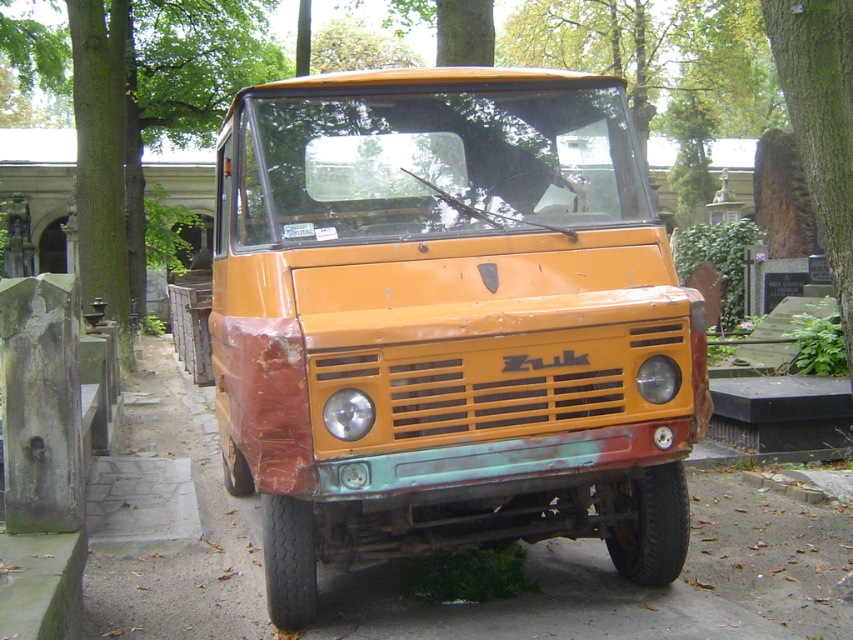
You are a delivery person trying to park your van between the smooth concrete pavement at center and the green rough bark tree at left. Can your van fit between them if the van is 2 meters wide?

The smooth concrete pavement at center is thinner than the green rough bark tree at left. Since the smooth concrete pavement at center is thinner, the space between them may be narrower than 2 meters. Therefore, the van might not fit comfortably between them.

You are a photographer planning to take a wide shot of the rusty orange truck at center and the green rough bark tree at left. Which object should you focus on first if you want to ensure both are in frame without moving the camera?

The rusty orange truck at center is smaller than the green rough bark tree at left, so you should focus on the green rough bark tree at left first to ensure it fits within the frame.